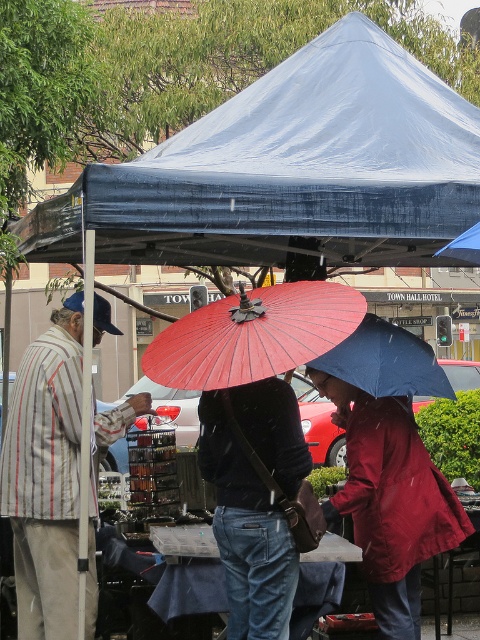
Is white matte canopy at upper center taller than striped fabric jacket at left?

Yes, white matte canopy at upper center is taller than striped fabric jacket at left.

Is point (233, 246) closer to camera compared to point (26, 470)?

No, it is not.

Is point (291, 164) behind point (46, 588)?

Yes, point (291, 164) is behind point (46, 588).

Locate an element on the screen. The width and height of the screenshot is (480, 640). white matte canopy at upper center is located at coordinates (289, 170).

Is white matte canopy at upper center smaller than matte blue umbrella at center?

Incorrect, white matte canopy at upper center is not smaller in size than matte blue umbrella at center.

Does point (392, 140) lie in front of point (367, 330)?

No.

What do you see at coordinates (289, 170) in the screenshot? I see `white matte canopy at upper center` at bounding box center [289, 170].

You are a GUI agent. You are given a task and a screenshot of the screen. Output one action in this format:
    pyautogui.click(x=<x>, y=<y>)
    Task: Click on the white matte canopy at upper center
    Image resolution: width=480 pixels, height=640 pixels.
    Given the screenshot: What is the action you would take?
    [289, 170]

You are a GUI agent. You are given a task and a screenshot of the screen. Output one action in this format:
    pyautogui.click(x=<x>, y=<y>)
    Task: Click on the white matte canopy at upper center
    The image size is (480, 640).
    Given the screenshot: What is the action you would take?
    pyautogui.click(x=289, y=170)

Is white matte canopy at upper center positioned before matte red coat at lower right?

Yes.

Locate an element on the screen. Image resolution: width=480 pixels, height=640 pixels. white matte canopy at upper center is located at coordinates (289, 170).